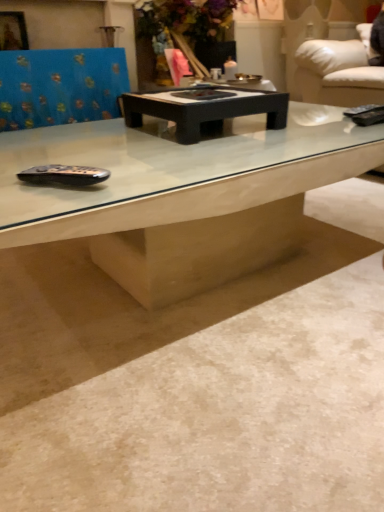
What do you see at coordinates (194, 386) in the screenshot?
I see `white marble concrete at center` at bounding box center [194, 386].

You are a GUI agent. You are given a task and a screenshot of the screen. Output one action in this format:
    pyautogui.click(x=<x>, y=<y>)
    Task: Click on the white marble concrete at center
    The image size is (384, 512).
    Given the screenshot: What is the action you would take?
    pyautogui.click(x=194, y=386)

Is black matte coffee table at center looking in the opposite direction of blue fabric swivel chair at upper left?

Yes, black matte coffee table at center is positioned with its back facing blue fabric swivel chair at upper left.

What's the angular difference between black matte coffee table at center and blue fabric swivel chair at upper left's facing directions?

The angle between the facing direction of black matte coffee table at center and the facing direction of blue fabric swivel chair at upper left is 1.99 degrees.

Is point (237, 106) closer to viewer compared to point (19, 89)?

Yes, it is.

Measure the distance between black matte coffee table at center and blue fabric swivel chair at upper left.

A distance of 71.67 centimeters exists between black matte coffee table at center and blue fabric swivel chair at upper left.

From the picture: Is white marble concrete at center wider than blue fabric swivel chair at upper left?

Indeed, white marble concrete at center has a greater width compared to blue fabric swivel chair at upper left.

Does point (80, 341) appear closer or farther from the camera than point (58, 76)?

Point (80, 341) is positioned closer to the camera compared to point (58, 76).

Would you say white marble concrete at center is to the left or to the right of blue fabric swivel chair at upper left in the picture?

white marble concrete at center is positioned on blue fabric swivel chair at upper left's right side.

Does white marble concrete at center turn towards blue fabric swivel chair at upper left?

No, white marble concrete at center is not oriented towards blue fabric swivel chair at upper left.

Is white marble concrete at center at the back of blue fabric swivel chair at upper left?

No, white marble concrete at center is not at the back of blue fabric swivel chair at upper left.

From a real-world perspective, is blue fabric swivel chair at upper left physically located above or below white marble concrete at center?

blue fabric swivel chair at upper left is situated higher than white marble concrete at center in the real world.

Is point (106, 116) closer to camera compared to point (312, 262)?

No, (106, 116) is further to viewer.

There is a white marble concrete at center. At what (x,y) coordinates should I click in order to perform the action: click on swivel chair above it (from a real-world perspective). Please return your answer as a coordinate pair (x, y). This screenshot has width=384, height=512. Looking at the image, I should click on (60, 86).

Is white marble concrete at center wider than black matte coffee table at center?

Indeed, white marble concrete at center has a greater width compared to black matte coffee table at center.

From a real-world perspective, is white marble concrete at center over black matte coffee table at center?

No, from a real-world perspective, white marble concrete at center is not on top of black matte coffee table at center.

Looking at this image, which is more to the left, white marble concrete at center or black matte coffee table at center?

From the viewer's perspective, black matte coffee table at center appears more on the left side.

Is white marble concrete at center facing away from black matte coffee table at center?

No.

Is blue fabric swivel chair at upper left beside black matte coffee table at center?

No, blue fabric swivel chair at upper left is not making contact with black matte coffee table at center.

How different are the orientations of blue fabric swivel chair at upper left and black matte coffee table at center in degrees?

There is a 1.99-degree angle between the facing directions of blue fabric swivel chair at upper left and black matte coffee table at center.

Do you think blue fabric swivel chair at upper left is within black matte coffee table at center, or outside of it?

Result: blue fabric swivel chair at upper left is not inside black matte coffee table at center, it's outside.

Which is closer, (52, 65) or (239, 97)?

Clearly, point (52, 65) is more distant from the camera than point (239, 97).

Is there a large distance between black matte coffee table at center and white marble concrete at center?

No, black matte coffee table at center is not far from white marble concrete at center.

Can we say black matte coffee table at center lies outside white marble concrete at center?

Yes, black matte coffee table at center is not within white marble concrete at center.

The height and width of the screenshot is (512, 384). In order to click on coffee table above the white marble concrete at center (from the image's perspective) in this screenshot , I will do `click(204, 109)`.

The height and width of the screenshot is (512, 384). In order to click on coffee table below the blue fabric swivel chair at upper left (from the image's perspective) in this screenshot , I will do [204, 109].

Find the location of a particular element. Image resolution: width=384 pixels, height=512 pixels. concrete directly beneath the blue fabric swivel chair at upper left (from a real-world perspective) is located at coordinates (194, 386).

Estimate the real-world distances between objects in this image. Which object is further from blue fabric swivel chair at upper left, white marble concrete at center or black matte coffee table at center?

white marble concrete at center.

From the image, which object appears to be nearer to blue fabric swivel chair at upper left, black matte coffee table at center or white marble concrete at center?

black matte coffee table at center.

Considering their positions, is black matte coffee table at center positioned closer to white marble concrete at center than blue fabric swivel chair at upper left?

black matte coffee table at center is closer to white marble concrete at center.

Considering their positions, is white marble concrete at center positioned further to black matte coffee table at center than blue fabric swivel chair at upper left?

Based on the image, blue fabric swivel chair at upper left appears to be further to black matte coffee table at center.

From the image, which object appears to be farther from black matte coffee table at center, blue fabric swivel chair at upper left or white marble concrete at center?

The object further to black matte coffee table at center is blue fabric swivel chair at upper left.

Which object lies nearer to the anchor point white marble concrete at center, blue fabric swivel chair at upper left or black matte coffee table at center?

black matte coffee table at center lies closer to white marble concrete at center than the other object.

What are the coordinates of `coffee table located between white marble concrete at center and blue fabric swivel chair at upper left in the depth direction` in the screenshot? It's located at (204, 109).